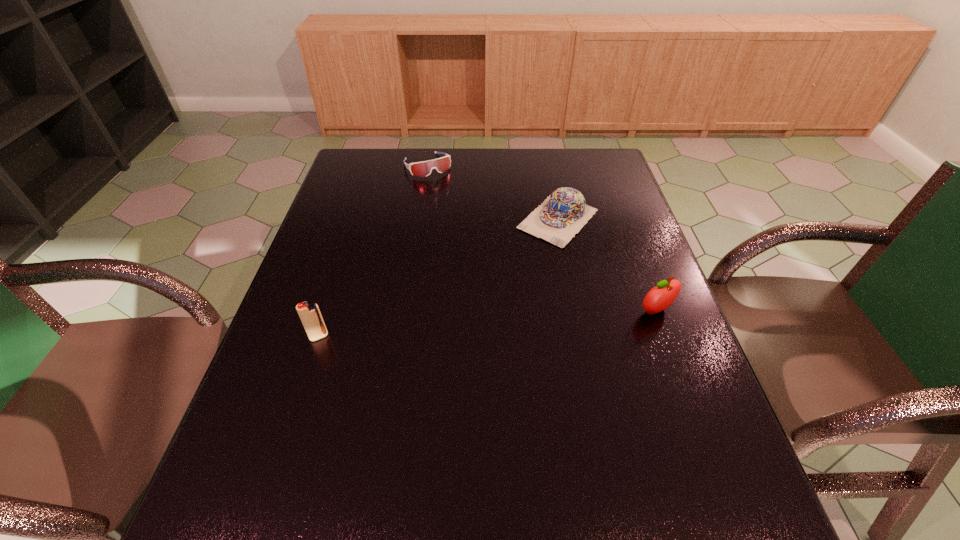
The image size is (960, 540). I want to click on the leftmost object, so click(310, 315).

The width and height of the screenshot is (960, 540). Find the location of `igniter`. igniter is located at coordinates (310, 315).

Image resolution: width=960 pixels, height=540 pixels. What are the coordinates of `the third farthest object` in the screenshot? It's located at (660, 297).

You are a GUI agent. You are given a task and a screenshot of the screen. Output one action in this format:
    pyautogui.click(x=<x>, y=<y>)
    Task: Click on the apple
    
    Given the screenshot: What is the action you would take?
    pyautogui.click(x=660, y=297)

Identify the location of the second object from right to left. The width and height of the screenshot is (960, 540). point(563,214).

Find the location of a particular element. cap is located at coordinates (563, 214).

At what (x,y) coordinates should I click in order to perform the action: click on the third object from right to left. Please return your answer as a coordinate pair (x, y). The image size is (960, 540). Looking at the image, I should click on (423, 169).

The height and width of the screenshot is (540, 960). I want to click on goggles, so tap(423, 169).

This screenshot has width=960, height=540. In order to click on free space located on the right of the leftmost object in this screenshot , I will do `click(489, 336)`.

Where is `vacant position located on the back of the third farthest object`? The image size is (960, 540). vacant position located on the back of the third farthest object is located at coordinates (629, 238).